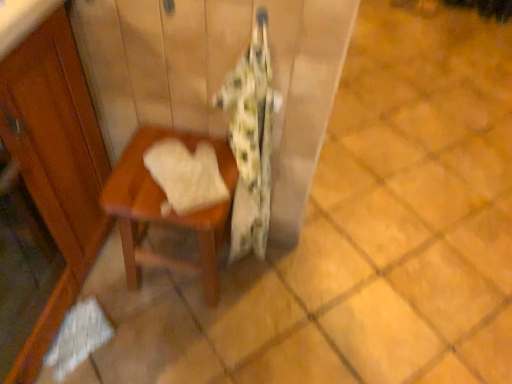
Describe the element at coordinates (168, 215) in the screenshot. I see `wooden table at center` at that location.

Find the location of a particular element. Image resolution: width=512 pixels, height=384 pixels. fluffy white blanket at center is located at coordinates (251, 140).

Where is `white soft towel at center`? Image resolution: width=512 pixels, height=384 pixels. white soft towel at center is located at coordinates (186, 175).

Which is further, (264, 152) or (185, 213)?

The point (264, 152) is farther.

Based on the photo, from a real-world perspective, between fluffy white blanket at center and white soft towel at center, who is vertically higher?

white soft towel at center.

Could white soft towel at center be considered to be inside fluffy white blanket at center?

Indeed, white soft towel at center is located within fluffy white blanket at center.

Image resolution: width=512 pixels, height=384 pixels. What are the coordinates of `blanket below the white soft towel at center (from the image's perspective)` in the screenshot? It's located at (251, 140).

Is white soft towel at center directly adjacent to fluffy white blanket at center?

They are not placed beside each other.

Considering the relative sizes of white soft towel at center and fluffy white blanket at center in the image provided, is white soft towel at center bigger than fluffy white blanket at center?

Actually, white soft towel at center might be smaller than fluffy white blanket at center.

How many degrees apart are the facing directions of white soft towel at center and fluffy white blanket at center?

There is a 42.2-degree angle between the facing directions of white soft towel at center and fluffy white blanket at center.

From a real-world perspective, between white soft towel at center and fluffy white blanket at center, who is vertically higher?

white soft towel at center.

From a real-world perspective, is fluffy white blanket at center below wooden table at center?

No.

Is fluffy white blanket at center touching wooden table at center?

fluffy white blanket at center and wooden table at center are not in contact.

How different are the orientations of fluffy white blanket at center and wooden table at center in degrees?

There is a 0.000448-degree angle between the facing directions of fluffy white blanket at center and wooden table at center.

Who is bigger, fluffy white blanket at center or wooden table at center?

wooden table at center.

Is point (111, 193) more distant than point (270, 161)?

No, (111, 193) is in front of (270, 161).

Can you confirm if wooden table at center is positioned to the left of fluffy white blanket at center?

Yes.

Consider the image. Who is more distant, wooden table at center or fluffy white blanket at center?

wooden table at center is further away from the camera.

From the image's perspective, who appears lower, wooden table at center or fluffy white blanket at center?

wooden table at center is shown below in the image.

Does wooden table at center come behind white soft towel at center?

Yes, wooden table at center is further from the viewer.

Consider the image. From a real-world perspective, is wooden table at center positioned above or below white soft towel at center?

In terms of real-world spatial position, wooden table at center is below white soft towel at center.

Considering the sizes of wooden table at center and white soft towel at center in the image, is wooden table at center bigger or smaller than white soft towel at center?

wooden table at center is bigger than white soft towel at center.

Which is in front, point (137, 287) or point (188, 212)?

The point (188, 212) is closer to the camera.

Are white soft towel at center and wooden table at center far apart?

That's not correct — white soft towel at center is a little close to wooden table at center.

How many degrees apart are the facing directions of white soft towel at center and wooden table at center?

They differ by 42.2 degrees in their facing directions.

From a real-world perspective, relative to wooden table at center, is white soft towel at center vertically above or below?

Clearly, from a real-world perspective, white soft towel at center is above wooden table at center.

Which object is positioned more to the right, white soft towel at center or wooden table at center?

Positioned to the right is white soft towel at center.

Find the location of `blanket in front of the white soft towel at center`. blanket in front of the white soft towel at center is located at coordinates click(251, 140).

The image size is (512, 384). Find the location of `bath towel lying on the left of fluffy white blanket at center`. bath towel lying on the left of fluffy white blanket at center is located at coordinates (186, 175).

Based on their spatial positions, is wooden table at center or fluffy white blanket at center closer to white soft towel at center?

Based on the image, wooden table at center appears to be nearer to white soft towel at center.

When comparing their distances from wooden table at center, does white soft towel at center or fluffy white blanket at center seem further?

The object further to wooden table at center is fluffy white blanket at center.

When comparing their distances from white soft towel at center, does fluffy white blanket at center or wooden table at center seem closer?

The object closer to white soft towel at center is wooden table at center.

From the image, which object appears to be farther from fluffy white blanket at center, wooden table at center or white soft towel at center?

white soft towel at center lies further to fluffy white blanket at center than the other object.

From the image, which object appears to be nearer to wooden table at center, fluffy white blanket at center or white soft towel at center?

Based on the image, white soft towel at center appears to be nearer to wooden table at center.

Considering their positions, is white soft towel at center positioned closer to fluffy white blanket at center than wooden table at center?

wooden table at center is positioned closer to the anchor fluffy white blanket at center.

You are a GUI agent. You are given a task and a screenshot of the screen. Output one action in this format:
    pyautogui.click(x=<x>, y=<y>)
    Task: Click on the bath towel positioned between fluffy white blanket at center and wooden table at center from near to far
    This screenshot has width=512, height=384.
    Given the screenshot: What is the action you would take?
    pyautogui.click(x=186, y=175)